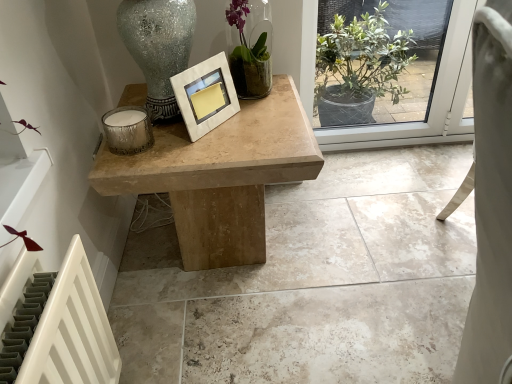
Where is `vacant space to the left of white marble picture frame at center`? vacant space to the left of white marble picture frame at center is located at coordinates (164, 135).